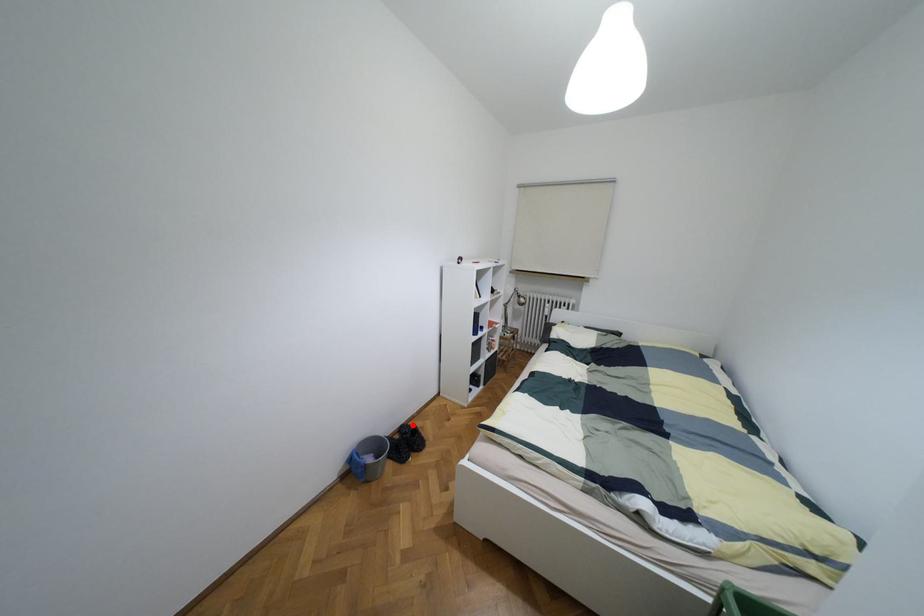
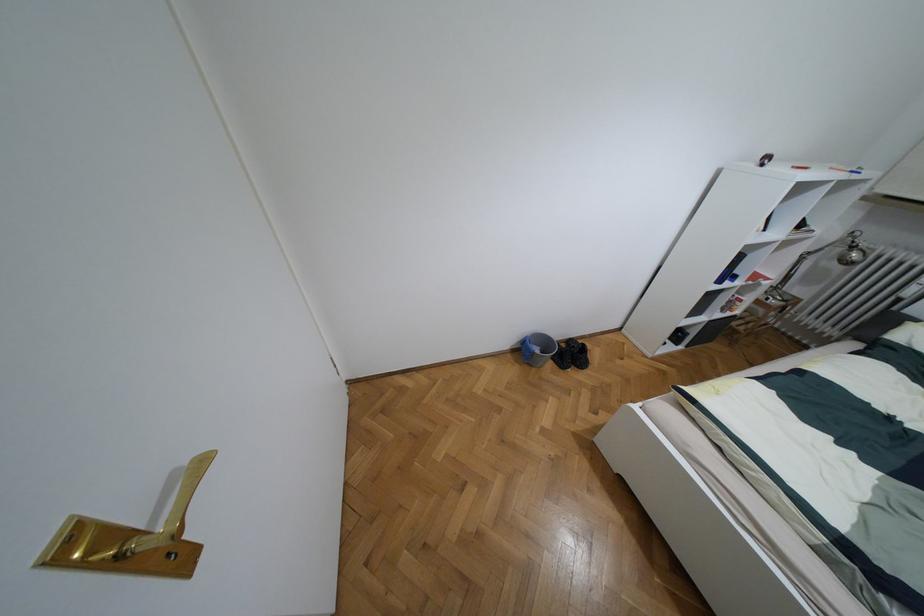
Question: A red point is marked in image1. In image2, is the corresponding 3D point closer to the camera or farther? Reply with the corresponding letter.

Choices:
 (A) The corresponding 3D point is closer.
 (B) The corresponding 3D point is farther.

Answer: (B)